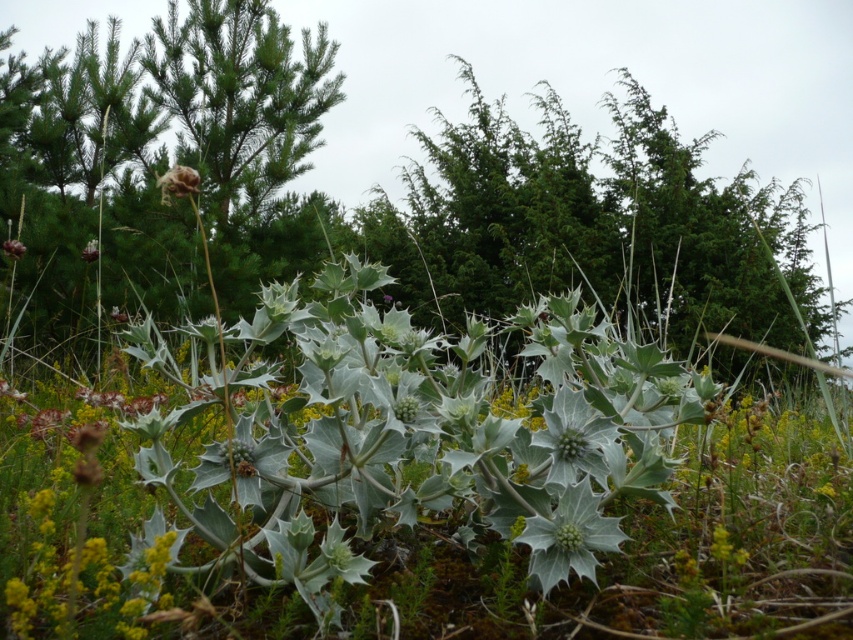
Between green spiky plant at center and fuzzy brown flower at upper center, which one has less height?

Standing shorter between the two is fuzzy brown flower at upper center.

Does green spiky plant at center lie in front of fuzzy brown flower at upper center?

No, it is not.

Where is `green spiky plant at center`? Image resolution: width=853 pixels, height=640 pixels. green spiky plant at center is located at coordinates (598, 83).

You are a GUI agent. You are given a task and a screenshot of the screen. Output one action in this format:
    pyautogui.click(x=<x>, y=<y>)
    Task: Click on the green spiky plant at center
    This screenshot has height=640, width=853.
    Given the screenshot: What is the action you would take?
    pyautogui.click(x=598, y=83)

Where is `green spiky plant at center`? The width and height of the screenshot is (853, 640). green spiky plant at center is located at coordinates (598, 83).

Can you confirm if green spiky plant at center is thinner than brown textured flower at upper left?

In fact, green spiky plant at center might be wider than brown textured flower at upper left.

At what (x,y) coordinates should I click in order to perform the action: click on green spiky plant at center. Please return your answer as a coordinate pair (x, y). This screenshot has width=853, height=640. Looking at the image, I should click on [x=598, y=83].

Is green spiky plant at center positioned before green matte flower at center?

No, it is not.

Is green spiky plant at center wider than green matte flower at center?

Yes.

Identify the location of green spiky plant at center. This screenshot has height=640, width=853. (598, 83).